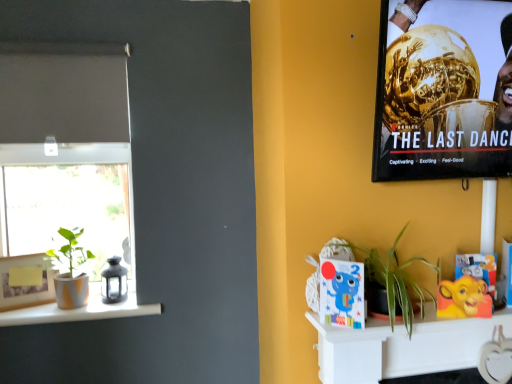
The width and height of the screenshot is (512, 384). What are the coordinates of `white matte shelf at lower right` in the screenshot? It's located at (402, 347).

What do you see at coordinates (402, 347) in the screenshot? The height and width of the screenshot is (384, 512). I see `white matte shelf at lower right` at bounding box center [402, 347].

Image resolution: width=512 pixels, height=384 pixels. Describe the element at coordinates (71, 270) in the screenshot. I see `green matte plant at left, which is the 1th houseplant from left to right` at that location.

What is the approximate width of green matte plant at left, which is the 1th houseplant from left to right?

6.51 inches.

Where is `cartoon blue elephant at center`? The width and height of the screenshot is (512, 384). cartoon blue elephant at center is located at coordinates (342, 293).

The height and width of the screenshot is (384, 512). Describe the element at coordinates (79, 311) in the screenshot. I see `matte orange vase at left` at that location.

In order to face green leafy plant at center-right, marked as the second houseplant in a left-to-right arrangement, should I rotate leftwards or rightwards?

Rotate right and turn 19.217 degrees.

At what (x,y) coordinates should I click in order to perform the action: click on white matte shelf at lower right. Please return your answer as a coordinate pair (x, y). Looking at the image, I should click on (402, 347).

Considering the positions of objects green leafy plant at center-right, which is the second houseplant from back to front, and green matte plant at left, which appears as the 2th houseplant when viewed from the front, in the image provided, who is in front, green leafy plant at center-right, which is the second houseplant from back to front, or green matte plant at left, which appears as the 2th houseplant when viewed from the front,?

green leafy plant at center-right, which is the second houseplant from back to front, is more forward.

Consider the image. Between green leafy plant at center-right, the first houseplant in the front-to-back sequence, and green matte plant at left, which is counted as the 2th houseplant, starting from the right, which one appears on the right side from the viewer's perspective?

Positioned to the right is green leafy plant at center-right, the first houseplant in the front-to-back sequence.

How different are the orientations of green leafy plant at center-right, which is the second houseplant from back to front, and green matte plant at left, which is counted as the 2th houseplant, starting from the right, in degrees?

green leafy plant at center-right, which is the second houseplant from back to front, and green matte plant at left, which is counted as the 2th houseplant, starting from the right, are facing 1.13 degrees away from each other.

From the image's perspective, who appears lower, green leafy plant at center-right, marked as the second houseplant in a left-to-right arrangement, or green matte plant at left, which is the 1th houseplant from left to right?

green matte plant at left, which is the 1th houseplant from left to right, appears lower in the image.

Which point is more distant from viewer, (488, 319) or (156, 309)?

The point (156, 309) is farther from the camera.

Does white matte shelf at lower right contain matte orange vase at left?

No.

Is white matte shelf at lower right bigger than matte orange vase at left?

No.

From a real-world perspective, who is located higher, white matte shelf at lower right or matte orange vase at left?

In real-world perspective, matte orange vase at left is above.

Could you tell me if green leafy plant at center-right, marked as the second houseplant in a left-to-right arrangement, is turned towards matte orange vase at left?

No, green leafy plant at center-right, marked as the second houseplant in a left-to-right arrangement, does not turn towards matte orange vase at left.

Considering the positions of objects green leafy plant at center-right, which is the first houseplant in right-to-left order, and matte orange vase at left in the image provided, who is more to the left, green leafy plant at center-right, which is the first houseplant in right-to-left order, or matte orange vase at left?

From the viewer's perspective, matte orange vase at left appears more on the left side.

From the image's perspective, is green leafy plant at center-right, which is the first houseplant in right-to-left order, over matte orange vase at left?

Yes, from the image's perspective, green leafy plant at center-right, which is the first houseplant in right-to-left order, is above matte orange vase at left.

Image resolution: width=512 pixels, height=384 pixels. I want to click on animal lying above the matte orange vase at left (from the image's perspective), so click(342, 293).

Is cartoon blue elephant at center a part of matte orange vase at left?

Definitely not — cartoon blue elephant at center is not inside matte orange vase at left.

From the image's perspective, between matte orange vase at left and cartoon blue elephant at center, who is located below?

From the image's view, matte orange vase at left is below.

From a real-world perspective, is green matte plant at left, the first houseplant viewed from the back, positioned over metallic gold trophy at upper right based on gravity?

No, from a real-world perspective, green matte plant at left, the first houseplant viewed from the back, is not above metallic gold trophy at upper right.

From the image's perspective, would you say green matte plant at left, which is the 1th houseplant from left to right, is positioned over metallic gold trophy at upper right?

No, from the image's perspective, green matte plant at left, which is the 1th houseplant from left to right, is not over metallic gold trophy at upper right.

Could you tell me if green matte plant at left, which is counted as the 2th houseplant, starting from the right, is turned towards metallic gold trophy at upper right?

No, green matte plant at left, which is counted as the 2th houseplant, starting from the right, is not turned towards metallic gold trophy at upper right.

Considering the relative sizes of green matte plant at left, which appears as the 2th houseplant when viewed from the front, and metallic gold trophy at upper right in the image provided, is green matte plant at left, which appears as the 2th houseplant when viewed from the front, bigger than metallic gold trophy at upper right?

Incorrect, green matte plant at left, which appears as the 2th houseplant when viewed from the front, is not larger than metallic gold trophy at upper right.

Does green matte plant at left, which is counted as the 2th houseplant, starting from the right, have a lesser height compared to matte orange vase at left?

No.

Is green matte plant at left, the first houseplant viewed from the back, in contact with matte orange vase at left?

No, green matte plant at left, the first houseplant viewed from the back, is not in contact with matte orange vase at left.

Is green matte plant at left, which is counted as the 2th houseplant, starting from the right, closer to the viewer compared to matte orange vase at left?

No, green matte plant at left, which is counted as the 2th houseplant, starting from the right, is behind matte orange vase at left.

Which object is thinner, green matte plant at left, which is the 1th houseplant from left to right, or matte orange vase at left?

With smaller width is green matte plant at left, which is the 1th houseplant from left to right.

Considering the relative positions of cartoon blue elephant at center and white matte shelf at lower right in the image provided, is cartoon blue elephant at center in front of white matte shelf at lower right?

Yes, cartoon blue elephant at center is in front of white matte shelf at lower right.

From a real-world perspective, which is physically above, cartoon blue elephant at center or white matte shelf at lower right?

cartoon blue elephant at center.

In the scene shown: Which of these two, cartoon blue elephant at center or white matte shelf at lower right, stands shorter?

Standing shorter between the two is white matte shelf at lower right.

Considering the positions of objects cartoon blue elephant at center and white matte shelf at lower right in the image provided, who is more to the right, cartoon blue elephant at center or white matte shelf at lower right?

From the viewer's perspective, white matte shelf at lower right appears more on the right side.

The image size is (512, 384). In order to click on houseplant that appears below the green leafy plant at center-right, which is the first houseplant in right-to-left order (from the image's perspective) in this screenshot , I will do `click(71, 270)`.

I want to click on shelf on the right side of matte orange vase at left, so coord(402,347).

Based on their spatial positions, is green matte plant at left, which appears as the 2th houseplant when viewed from the front, or green leafy plant at center-right, which is the second houseplant from back to front, closer to white matte shelf at lower right?

green leafy plant at center-right, which is the second houseplant from back to front, lies closer to white matte shelf at lower right than the other object.

From the image, which object appears to be nearer to green matte plant at left, which appears as the 2th houseplant when viewed from the front, green leafy plant at center-right, the first houseplant in the front-to-back sequence, or white matte shelf at lower right?

green leafy plant at center-right, the first houseplant in the front-to-back sequence.

Which object lies further to the anchor point cartoon blue elephant at center, metallic gold trophy at upper right or green leafy plant at center-right, marked as the second houseplant in a left-to-right arrangement?

Among the two, metallic gold trophy at upper right is located further to cartoon blue elephant at center.

Considering their positions, is matte orange vase at left positioned closer to metallic gold trophy at upper right than cartoon blue elephant at center?

cartoon blue elephant at center lies closer to metallic gold trophy at upper right than the other object.

Looking at the image, which one is located closer to white matte shelf at lower right, matte orange vase at left or green leafy plant at center-right, marked as the second houseplant in a left-to-right arrangement?

Based on the image, green leafy plant at center-right, marked as the second houseplant in a left-to-right arrangement, appears to be nearer to white matte shelf at lower right.

From the image, which object appears to be nearer to green matte plant at left, the first houseplant viewed from the back, matte orange vase at left or cartoon blue elephant at center?

matte orange vase at left is positioned closer to the anchor green matte plant at left, the first houseplant viewed from the back.

Based on their spatial positions, is cartoon blue elephant at center or green matte plant at left, which appears as the 2th houseplant when viewed from the front, closer to green leafy plant at center-right, which is the second houseplant from back to front?

Among the two, cartoon blue elephant at center is located nearer to green leafy plant at center-right, which is the second houseplant from back to front.

From the image, which object appears to be farther from matte orange vase at left, white matte shelf at lower right or cartoon blue elephant at center?

Among the two, white matte shelf at lower right is located further to matte orange vase at left.

Identify the location of animal between matte orange vase at left and green leafy plant at center-right, which is the second houseplant from back to front. pos(342,293).

Where is `animal located between green matte plant at left, the first houseplant viewed from the back, and green leafy plant at center-right, the first houseplant in the front-to-back sequence, in the left-right direction`? The image size is (512, 384). animal located between green matte plant at left, the first houseplant viewed from the back, and green leafy plant at center-right, the first houseplant in the front-to-back sequence, in the left-right direction is located at coordinates (342, 293).

Where is `animal between matte orange vase at left and white matte shelf at lower right from left to right`? animal between matte orange vase at left and white matte shelf at lower right from left to right is located at coordinates (342, 293).

Where is `houseplant between matte orange vase at left and white matte shelf at lower right from left to right`? This screenshot has width=512, height=384. houseplant between matte orange vase at left and white matte shelf at lower right from left to right is located at coordinates (394, 278).